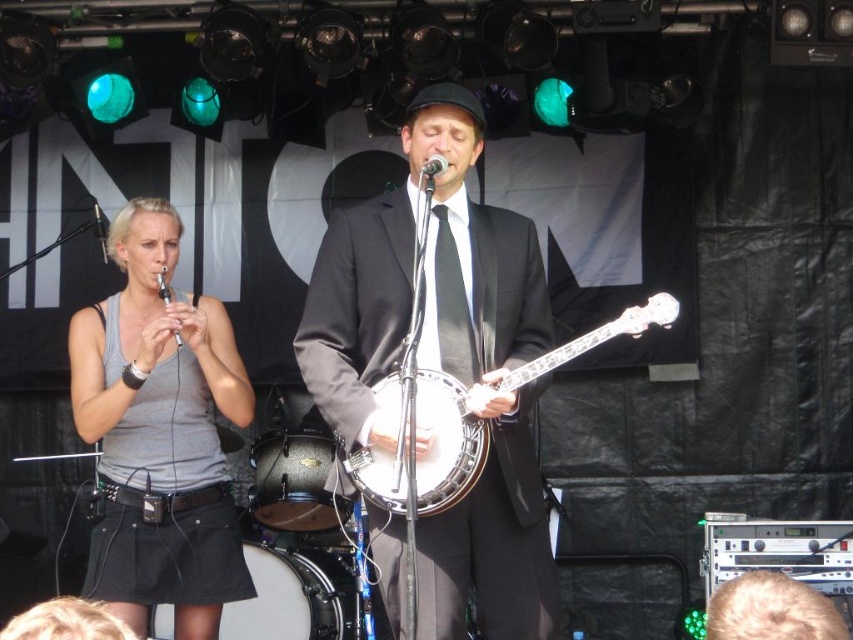
You are a photographer at the event and want to capture a photo where both the matte black banjo at center and the gray fabric skirt at left are clearly visible. Based on their positions, which object will appear larger in the photo?

The matte black banjo at center will appear larger in the photo because it is closer to the viewer than the gray fabric skirt at left.

You are standing at the center of the stage. Looking towards the left side, where is the gray fabric skirt at left located in relation to your current position?

The gray fabric skirt at left is located at the left side of the stage, positioned at coordinates approximately 0.678 on the x axis and 0.188 on the y axis relative to the stage center.